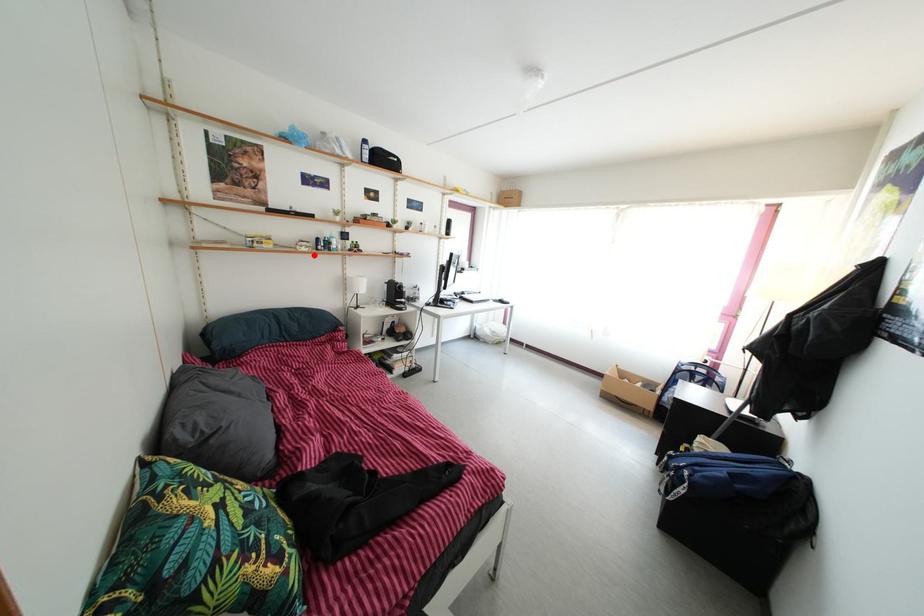
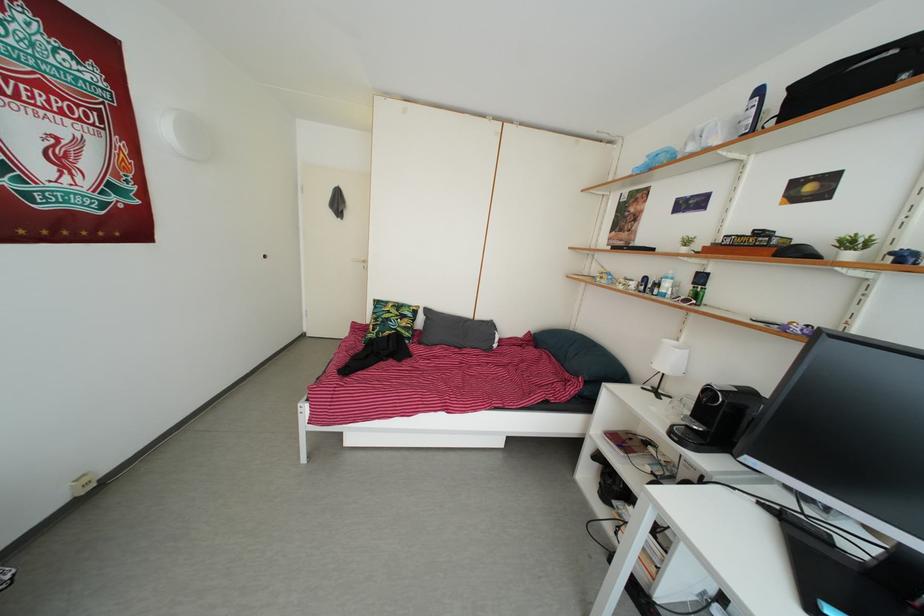
Locate, in the second image, the point that corresponds to the highlighted location in the first image.

(630, 293)